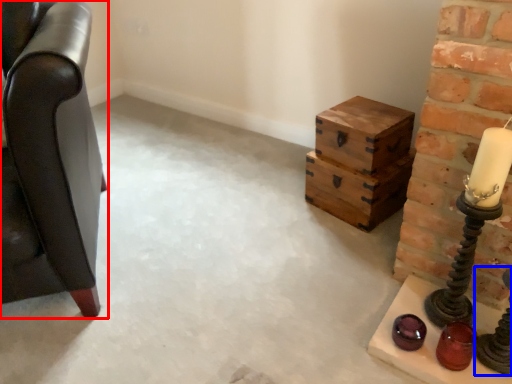
Question: Which object is closer to the camera taking this photo, furniture (highlighted by a red box) or candle holder (highlighted by a blue box)?

Choices:
 (A) furniture
 (B) candle holder

Answer: (A)